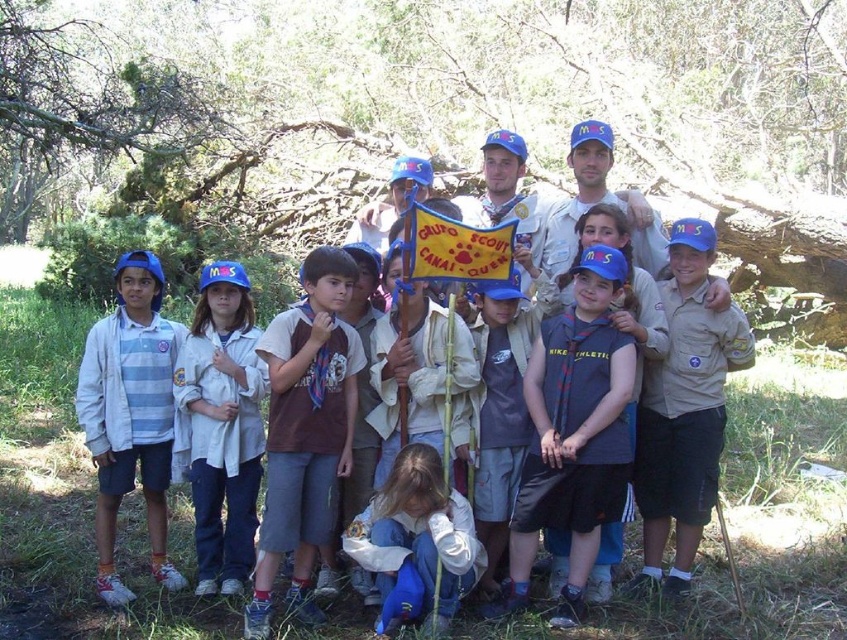
Question: Considering the relative positions of dark blue jersey at center and blue fabric pants at center in the image provided, where is dark blue jersey at center located with respect to blue fabric pants at center?

Choices:
 (A) left
 (B) right

Answer: (B)

Question: Can you confirm if dark blue jersey at center is smaller than striped cotton shirt at left?

Choices:
 (A) no
 (B) yes

Answer: (B)

Question: Which object is closer to the camera taking this photo?

Choices:
 (A) yellow fabric flag at center
 (B) striped cotton shirt at left
 (C) white matte shirt at center
 (D) dark blue jersey at center

Answer: (D)

Question: Is dark blue jersey at center above white matte shirt at center?

Choices:
 (A) yes
 (B) no

Answer: (B)

Question: Which point appears closest to the camera in this image?

Choices:
 (A) (375, 620)
 (B) (214, 541)
 (C) (613, 460)

Answer: (C)

Question: Which of the following is the closest to the observer?

Choices:
 (A) 275,394
 (B) 208,333

Answer: (A)